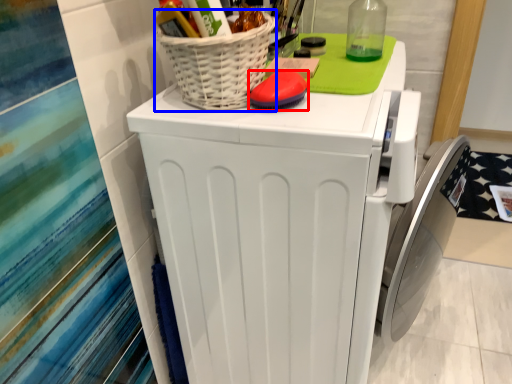
Question: Which object appears closest to the camera in this image, soap (highlighted by a red box) or basket (highlighted by a blue box)?

Choices:
 (A) soap
 (B) basket

Answer: (B)